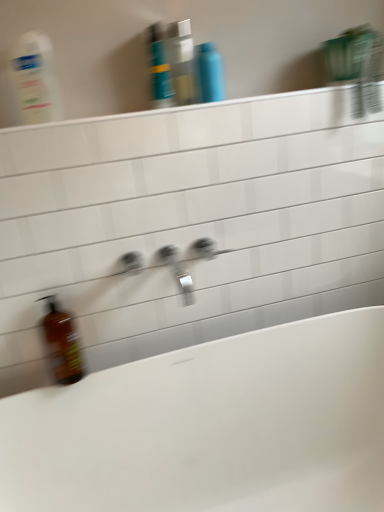
Question: Does translucent plastic mouthwash at upper center, acting as the second mouthwash starting from the right, have a lesser width compared to translucent plastic bottle at upper left?

Choices:
 (A) yes
 (B) no

Answer: (B)

Question: From the image's perspective, does translucent plastic mouthwash at upper center, acting as the second mouthwash starting from the right, appear lower than translucent plastic bottle at upper left?

Choices:
 (A) no
 (B) yes

Answer: (A)

Question: Is translucent plastic mouthwash at upper center, acting as the second mouthwash starting from the right, facing away from translucent plastic bottle at upper left?

Choices:
 (A) no
 (B) yes

Answer: (A)

Question: From a real-world perspective, is translucent plastic mouthwash at upper center, acting as the second mouthwash starting from the right, under translucent plastic bottle at upper left?

Choices:
 (A) no
 (B) yes

Answer: (B)

Question: Does translucent plastic mouthwash at upper center, acting as the second mouthwash starting from the right, have a smaller size compared to translucent plastic bottle at upper left?

Choices:
 (A) no
 (B) yes

Answer: (B)

Question: Is silver metallic tap at center wider or thinner than brown glass bottle at lower left?

Choices:
 (A) wide
 (B) thin

Answer: (A)

Question: Does point (163, 250) appear closer or farther from the camera than point (67, 328)?

Choices:
 (A) farther
 (B) closer

Answer: (B)

Question: In terms of size, does silver metallic tap at center appear bigger or smaller than brown glass bottle at lower left?

Choices:
 (A) small
 (B) big

Answer: (A)

Question: Is silver metallic tap at center to the left or to the right of brown glass bottle at lower left in the image?

Choices:
 (A) right
 (B) left

Answer: (A)

Question: Is blue glossy shampoo bottle at upper center to the left or to the right of translucent plastic mouthwash at upper center, the first mouthwash viewed from the left, in the image?

Choices:
 (A) left
 (B) right

Answer: (A)

Question: Is blue glossy shampoo bottle at upper center inside or outside of translucent plastic mouthwash at upper center, the first mouthwash viewed from the left?

Choices:
 (A) inside
 (B) outside

Answer: (B)

Question: Based on their sizes in the image, would you say blue glossy shampoo bottle at upper center is bigger or smaller than translucent plastic mouthwash at upper center, acting as the second mouthwash starting from the right?

Choices:
 (A) big
 (B) small

Answer: (A)

Question: Is point (157, 80) positioned closer to the camera than point (175, 93)?

Choices:
 (A) closer
 (B) farther

Answer: (A)

Question: Considering the relative positions of translucent plastic bottle at upper left and silver metallic tap at center in the image provided, is translucent plastic bottle at upper left to the left or to the right of silver metallic tap at center?

Choices:
 (A) left
 (B) right

Answer: (A)

Question: Considering their positions, is translucent plastic bottle at upper left located in front of or behind silver metallic tap at center?

Choices:
 (A) behind
 (B) front

Answer: (B)